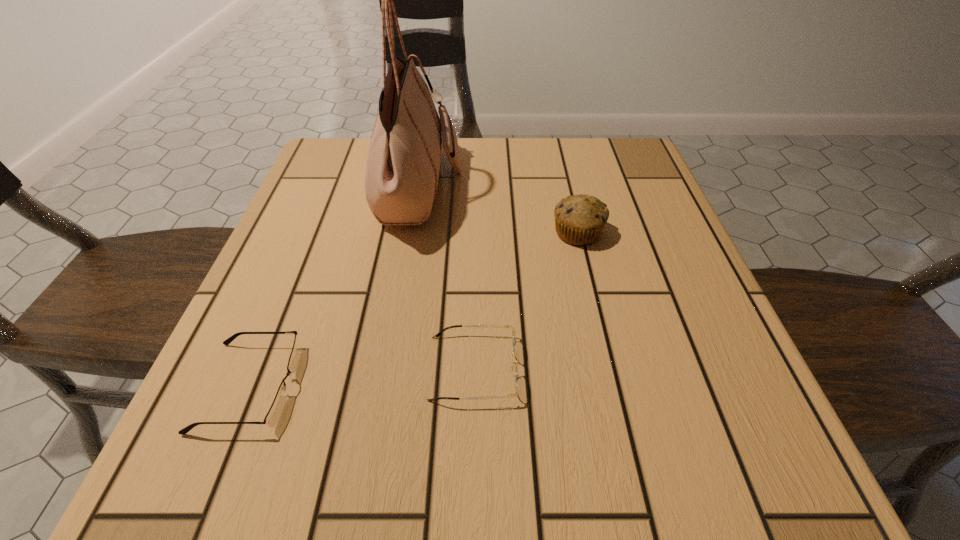
At what (x,y) coordinates should I click in order to perform the action: click on vacant space that's between the muffin and the tallest object. Please return your answer as a coordinate pair (x, y). This screenshot has height=540, width=960. Looking at the image, I should click on (499, 211).

Where is `free space that is in between the muffin and the left spectacles`? The image size is (960, 540). free space that is in between the muffin and the left spectacles is located at coordinates (414, 310).

Identify the location of vacant area between the handbag and the right spectacles. (446, 278).

The image size is (960, 540). Identify the location of vacant region between the muffin and the left spectacles. (414, 310).

You are a GUI agent. You are given a task and a screenshot of the screen. Output one action in this format:
    pyautogui.click(x=<x>, y=<y>)
    Task: Click on the vacant space that's between the left spectacles and the tallest object
    
    Given the screenshot: What is the action you would take?
    pyautogui.click(x=335, y=287)

The height and width of the screenshot is (540, 960). I want to click on free space that is in between the handbag and the rightmost object, so click(x=499, y=211).

The image size is (960, 540). In order to click on empty space between the left spectacles and the right spectacles in this screenshot , I will do `click(362, 377)`.

The width and height of the screenshot is (960, 540). I want to click on free space between the right spectacles and the leftmost object, so click(362, 377).

Where is `free space between the right spectacles and the muffin`? The image size is (960, 540). free space between the right spectacles and the muffin is located at coordinates (525, 301).

This screenshot has height=540, width=960. Find the location of `empty location between the leftmost object and the right spectacles`. empty location between the leftmost object and the right spectacles is located at coordinates (362, 377).